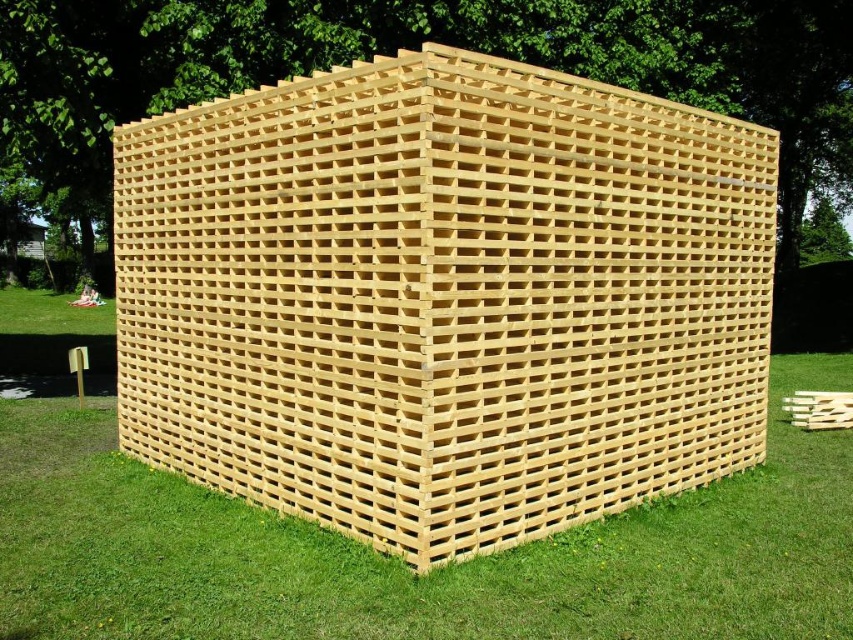
You are standing at point A located at coordinates (444,298) in the image. What object is exactly at your current position?

The natural wood lattice structure at center is exactly at point A located at coordinates (444,298).

You are standing in a park and see the natural wood lattice structure at center and the green grass at lower center. Which object is positioned higher from the ground?

The natural wood lattice structure at center is located above the green grass at lower center, so it is positioned higher from the ground.